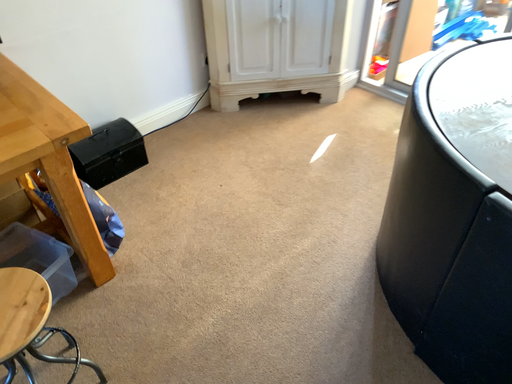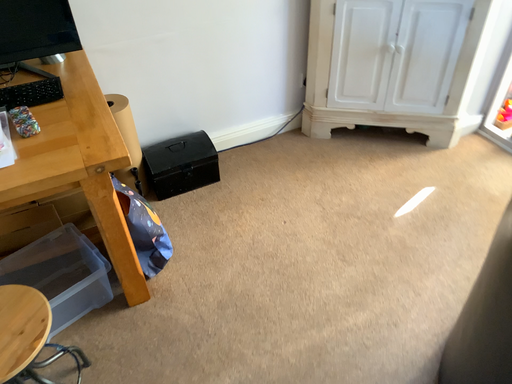
Question: How did the camera likely rotate when shooting the video?

Choices:
 (A) rotated left
 (B) rotated right

Answer: (A)